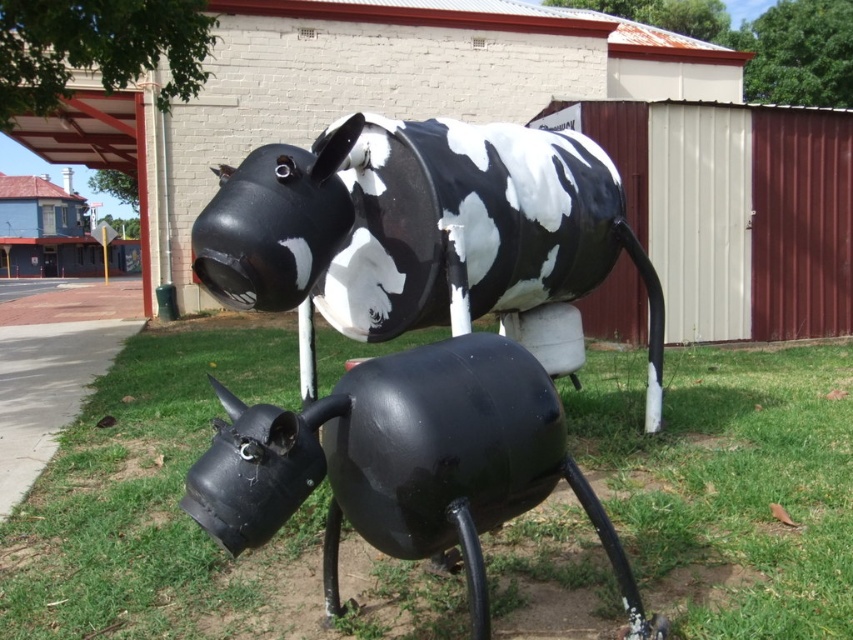
You are standing at the origin point of the coordinate system. The black matte cow at center is located at point 0.358, 0.495. If you want to walk directly towards it, in which direction should you move?

To reach the black matte cow at center located at coordinates (x=421, y=228) from the origin, you should move northeast since both x and y coordinates are positive.

Based on the photo, you are a photographer setting up a shot of the black matte cow at center and the glossy black cow at lower center. You need to ensure both are fully visible in the frame. Which cow should you position closer to the edge of the frame to avoid cropping either one?

You should position the glossy black cow at lower center closer to the edge of the frame because it is smaller in width than the black matte cow at center, allowing more space for the larger cow while keeping both fully visible.

You are a visitor at an outdoor art exhibition and want to take a photo of both the black matte cow at center and the glossy black cow at lower center in the same frame. Considering their sizes, which cow should you position closer to the camera to ensure both appear roughly the same size in your photo?

To make both cows appear roughly the same size in the photo, position the glossy black cow at lower center closer to the camera since it is smaller than the black matte cow at center. This adjustment will balance their apparent sizes in the frame.